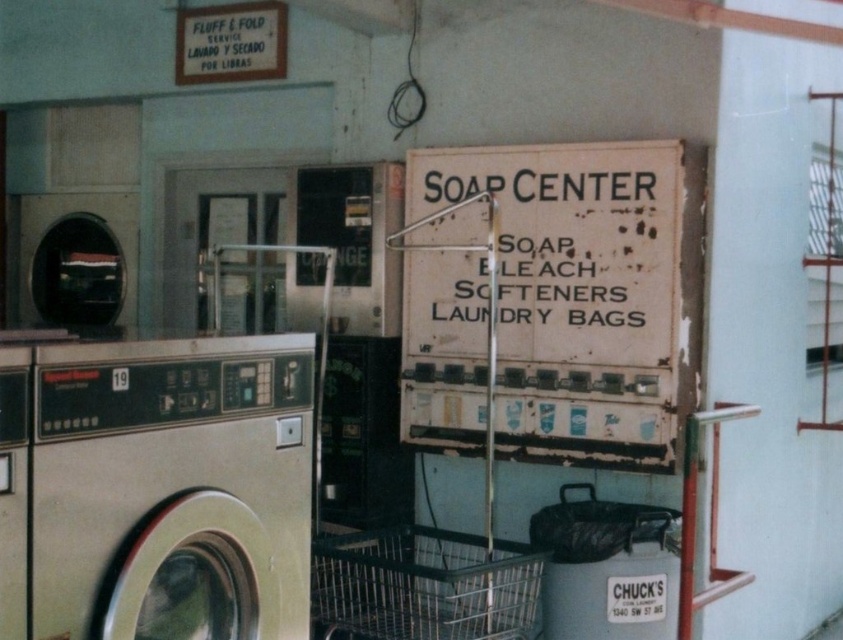
Who is more forward, [487,291] or [63,467]?

Positioned in front is point [63,467].

Does point (530, 394) lie in front of point (47, 417)?

No.

Where is `worn paper sign at center`? The width and height of the screenshot is (843, 640). worn paper sign at center is located at coordinates (550, 298).

Does worn paper sign at center have a greater width compared to metallic wire laundry basket at lower center?

Yes, worn paper sign at center is wider than metallic wire laundry basket at lower center.

The image size is (843, 640). Describe the element at coordinates (550, 298) in the screenshot. I see `worn paper sign at center` at that location.

You are a GUI agent. You are given a task and a screenshot of the screen. Output one action in this format:
    pyautogui.click(x=<x>, y=<y>)
    Task: Click on the worn paper sign at center
    This screenshot has width=843, height=640.
    Given the screenshot: What is the action you would take?
    pyautogui.click(x=550, y=298)

Can you confirm if metallic silver washing machine at left is positioned above metallic wire laundry basket at lower center?

Yes.

Is metallic silver washing machine at left positioned before metallic wire laundry basket at lower center?

Yes, metallic silver washing machine at left is in front of metallic wire laundry basket at lower center.

Where is `metallic silver washing machine at left`? The width and height of the screenshot is (843, 640). metallic silver washing machine at left is located at coordinates (172, 488).

Identify the location of metallic silver washing machine at left. The height and width of the screenshot is (640, 843). (172, 488).